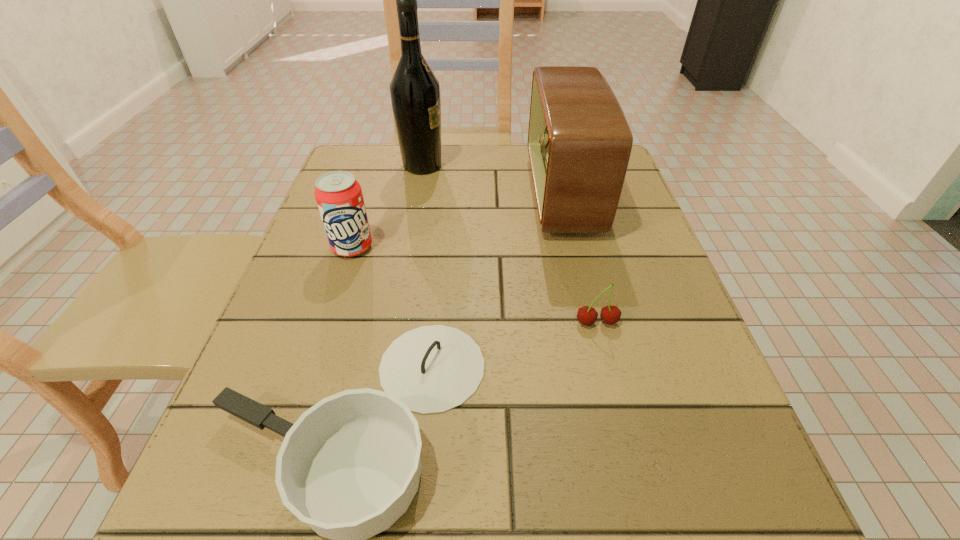
This screenshot has width=960, height=540. In order to click on wine bottle in this screenshot , I will do `click(415, 92)`.

You are a GUI agent. You are given a task and a screenshot of the screen. Output one action in this format:
    pyautogui.click(x=<x>, y=<y>)
    Task: Click on the radio receiver
    The image size is (960, 540).
    Given the screenshot: What is the action you would take?
    pyautogui.click(x=579, y=142)

Identify the location of soda can. (338, 194).

Locate an element on the screen. The width and height of the screenshot is (960, 540). cherry is located at coordinates (586, 315).

Identify the location of free location located 0.120m on the label of the wine bottle. (492, 166).

The image size is (960, 540). In order to click on free space located on the front-facing side of the radio receiver in this screenshot , I will do `click(510, 195)`.

In order to click on vacant space situated 0.250m on the front-facing side of the radio receiver in this screenshot , I will do `click(422, 195)`.

Locate an element on the screen. vacant space situated on the front-facing side of the radio receiver is located at coordinates (401, 195).

I want to click on vacant space located 0.310m on the surface of the third shortest object, so click(300, 406).

Where is `vacant area situated 0.300m on the surface of the second shortest object`? The image size is (960, 540). vacant area situated 0.300m on the surface of the second shortest object is located at coordinates (649, 532).